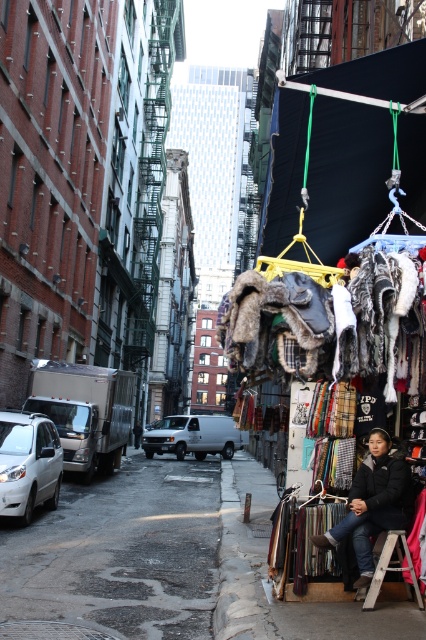
Question: Is wet asphalt at lower left wider than smooth wooden board at lower right?

Choices:
 (A) yes
 (B) no

Answer: (A)

Question: Which point is farther to the camera?

Choices:
 (A) wet asphalt at lower left
 (B) smooth wooden board at lower right
 (C) black fuzzy hat at lower right

Answer: (C)

Question: Which point appears closest to the camera in this image?

Choices:
 (A) (388, 499)
 (B) (98, 566)

Answer: (A)

Question: Which object is positioned closest to the wet asphalt at lower left?

Choices:
 (A) smooth wooden board at lower right
 (B) black fuzzy hat at lower right

Answer: (A)

Question: Is smooth wooden board at lower right further to the viewer compared to black fuzzy hat at lower right?

Choices:
 (A) no
 (B) yes

Answer: (A)

Question: Can you confirm if wet asphalt at lower left is thinner than smooth wooden board at lower right?

Choices:
 (A) no
 (B) yes

Answer: (A)